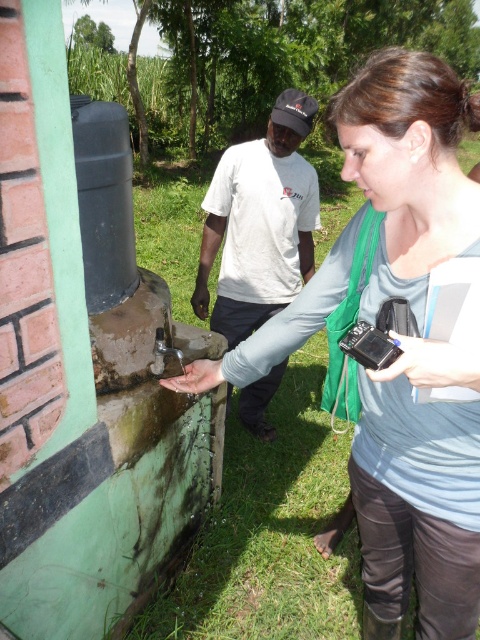
You are a photographer trying to capture both the matte gray shirt at center and the white cotton shirt at center in a single frame. Which shirt should you focus on to ensure both are in the frame without moving the camera?

The matte gray shirt at center is bigger than the white cotton shirt at center, so focusing on the matte gray shirt at center will help ensure both shirts are captured in the frame since it occupies more space.

Where is the matte gray shirt at center located in the image?

The matte gray shirt at center is located at point 0.775 in the x coordinate and 0.871 in the y coordinate.